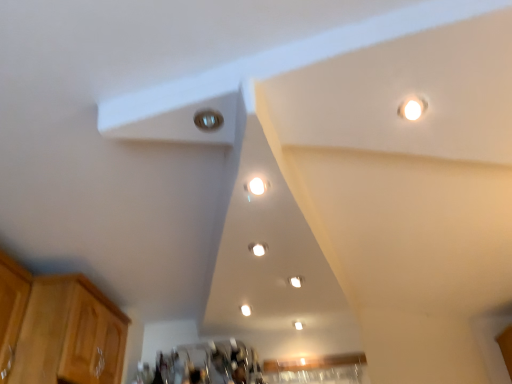
Question: Looking at the image, does white glossy light fixture at center, arranged as the 1th dot when ordered from the bottom, seem bigger or smaller compared to white glossy light fixture at center, which ranks as the third dot in bottom-to-top order?

Choices:
 (A) small
 (B) big

Answer: (B)

Question: Is white glossy light fixture at center, which is counted as the first dot, starting from the back, taller or shorter than white glossy light fixture at center, which is the 1th dot from front to back?

Choices:
 (A) tall
 (B) short

Answer: (B)

Question: Which is farther from the matte white light fixture at center, which is counted as the second dot, starting from the front?

Choices:
 (A) white glossy light fixture at center, positioned as the third dot in left-to-right order
 (B) light brown wood cabinet at lower left
 (C) metallic silver light at upper center
 (D) white glossy light fixture at center, acting as the 3th dot starting from the back

Answer: (B)

Question: Which of these objects is positioned closest to the light brown wood cabinet at lower left?

Choices:
 (A) white glossy light fixture at center, which is counted as the first dot, starting from the back
 (B) matte white light fixture at center, acting as the second dot starting from the right
 (C) metallic silver light at upper center
 (D) white glossy light fixture at center, which is the 1th dot from front to back

Answer: (B)